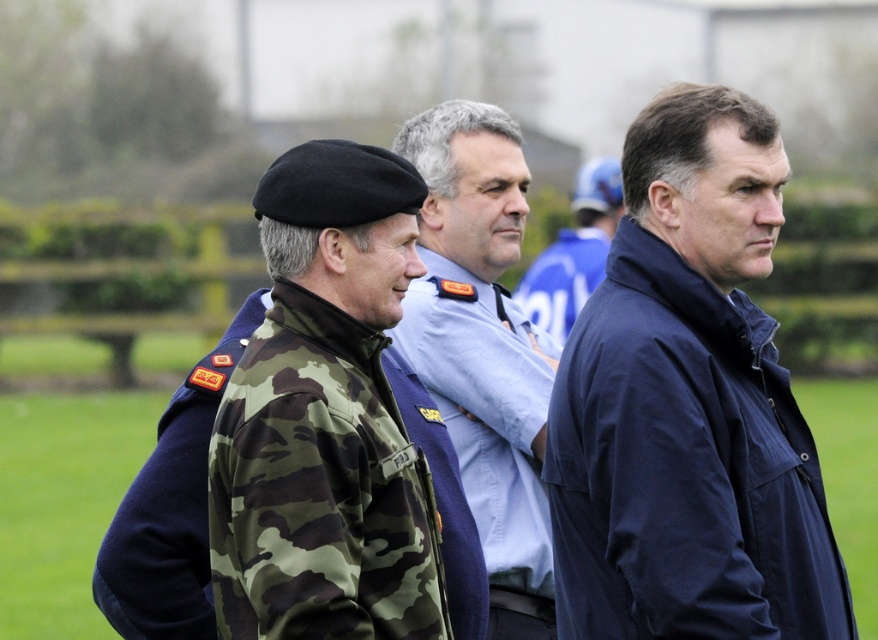
This screenshot has height=640, width=878. I want to click on camo fabric jacket at center, so click(171, 509).

Is camo fabric jacket at center below dark blue jacket at center?

Yes.

The height and width of the screenshot is (640, 878). What do you see at coordinates (171, 509) in the screenshot? I see `camo fabric jacket at center` at bounding box center [171, 509].

Identify the location of camo fabric jacket at center. This screenshot has height=640, width=878. (171, 509).

Which is more to the right, navy blue jacket at right or camouflage fabric jacket at center?

navy blue jacket at right

Is navy blue jacket at right bigger than camouflage fabric jacket at center?

Yes, navy blue jacket at right is bigger than camouflage fabric jacket at center.

You are a GUI agent. You are given a task and a screenshot of the screen. Output one action in this format:
    pyautogui.click(x=<x>, y=<y>)
    Task: Click on the navy blue jacket at right
    The width and height of the screenshot is (878, 640).
    Given the screenshot: What is the action you would take?
    pyautogui.click(x=688, y=404)

Can you confirm if camouflage fabric jacket at center is taller than dark blue jacket at center?

Incorrect, camouflage fabric jacket at center's height is not larger of dark blue jacket at center's.

Does camouflage fabric jacket at center come in front of dark blue jacket at center?

Yes.

Locate an element on the screen. This screenshot has height=640, width=878. camouflage fabric jacket at center is located at coordinates (488, 428).